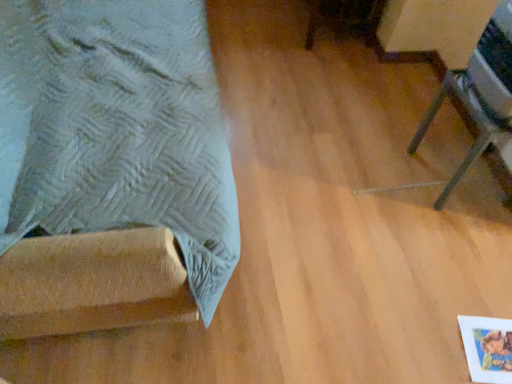
You are a GUI agent. You are given a task and a screenshot of the screen. Output one action in this format:
    pyautogui.click(x=<x>, y=<y>)
    Task: Click on the vacant area to the right of suede-like fabric at left, positioned as the second furniture in right-to-left order
    The image size is (512, 384).
    Given the screenshot: What is the action you would take?
    pyautogui.click(x=334, y=174)